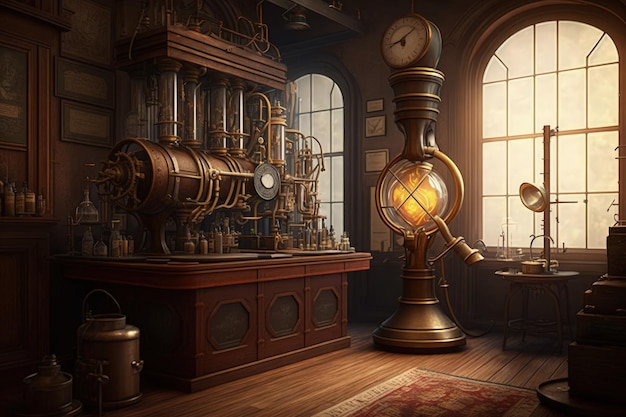
Locate an element on the screen. clock is located at coordinates (403, 55).